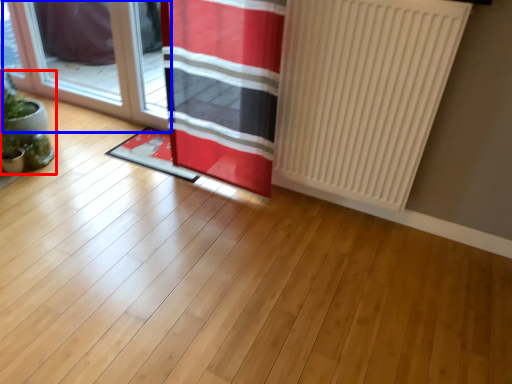
Question: Which object appears farthest to the camera in this image, houseplant (highlighted by a red box) or door (highlighted by a blue box)?

Choices:
 (A) houseplant
 (B) door

Answer: (B)